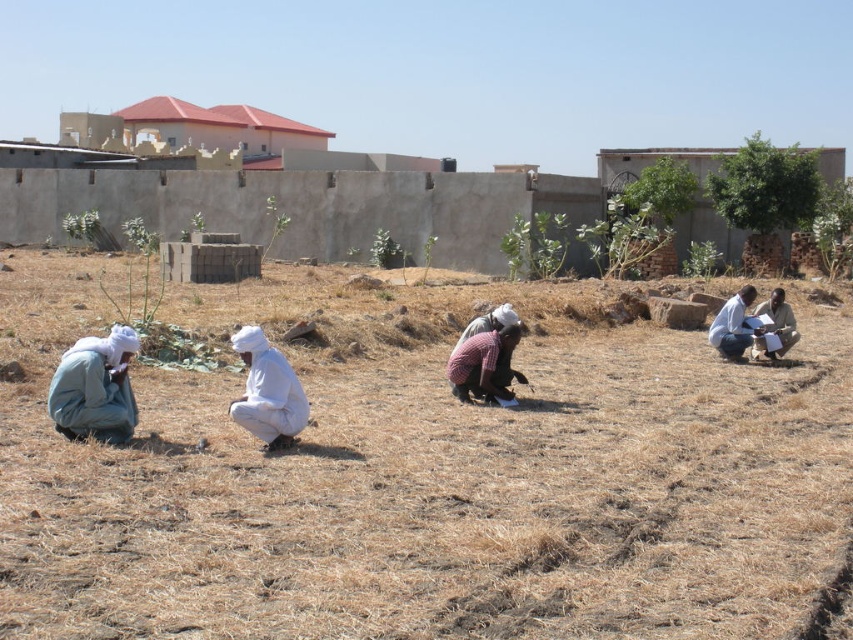
Between reddish-brown fabric at center and white cloth at right, which one appears on the left side from the viewer's perspective?

Positioned to the left is reddish-brown fabric at center.

Can you confirm if reddish-brown fabric at center is thinner than white cloth at right?

No.

Does point (469, 387) come behind point (741, 340)?

No, (469, 387) is closer to viewer.

Locate an element on the screen. reddish-brown fabric at center is located at coordinates (485, 365).

Who is lower down, light gray fabric at left or white cotton turban at center?

white cotton turban at center is below.

Does light gray fabric at left appear on the left side of white cotton turban at center?

Yes, light gray fabric at left is to the left of white cotton turban at center.

Find the location of `light gray fabric at left`. light gray fabric at left is located at coordinates (96, 388).

Who is more forward, [279,365] or [740,353]?

Point [279,365] is in front.

Is point (291, 371) positioned in front of point (718, 352)?

Yes, point (291, 371) is closer to viewer.

Measure the distance between point [289,422] and camera.

Point [289,422] and camera are 10.77 meters apart.

At what (x,y) coordinates should I click in order to perform the action: click on white cotton turban at center. Please return your answer as a coordinate pair (x, y). The height and width of the screenshot is (640, 853). Looking at the image, I should click on (267, 392).